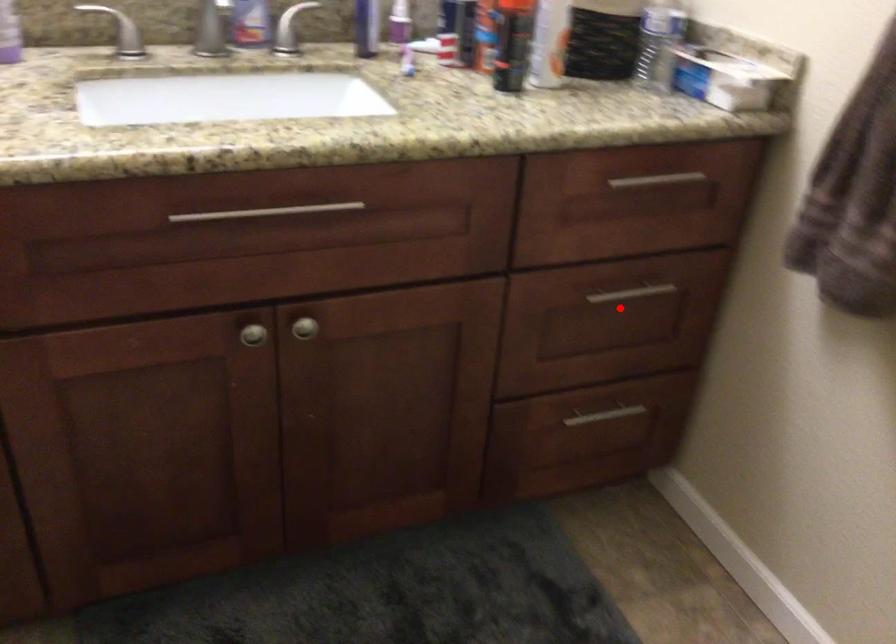
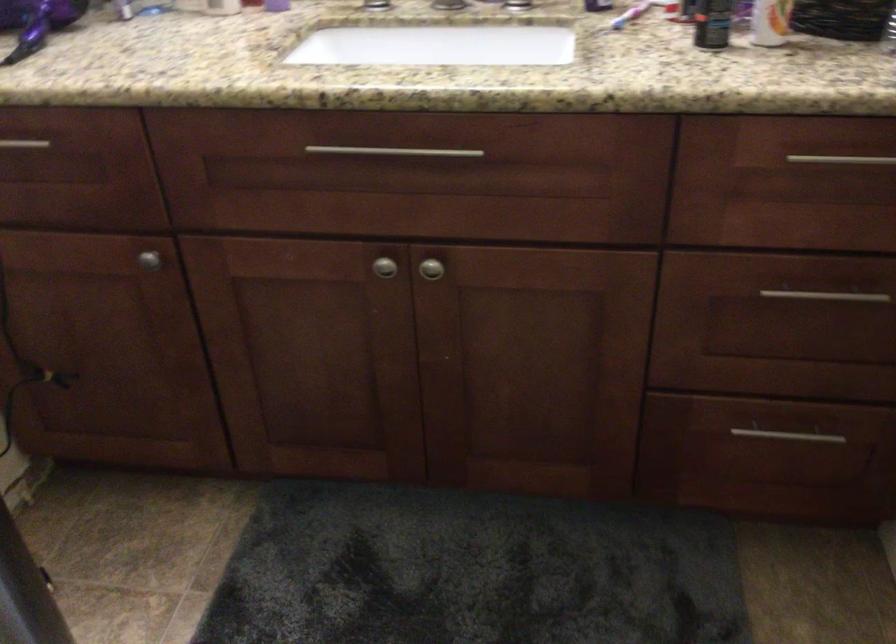
Question: I am providing you with two images of the same scene from different viewpoints. A red point is shown in image1. For the corresponding object point in image2, is it positioned nearer or farther from the camera?

Choices:
 (A) Nearer
 (B) Farther

Answer: (A)